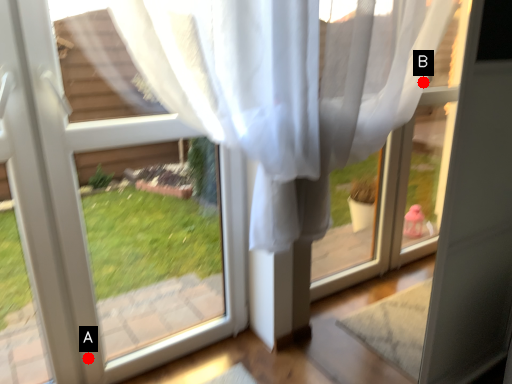
Question: Two points are circled on the image, labeled by A and B beside each circle. Which of the following is the farthest from the observer?

Choices:
 (A) A is further
 (B) B is further

Answer: (B)